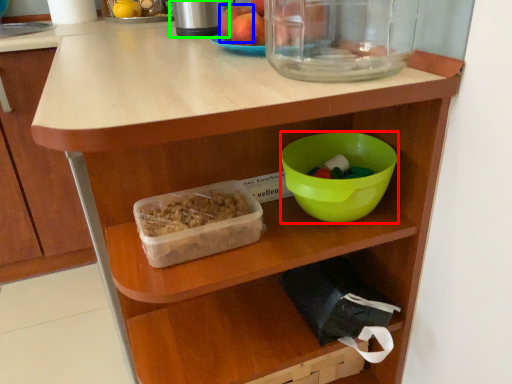
Question: Which object is the farthest from bowl (highlighted by a red box)? Choose among these: apple (highlighted by a blue box) or appliance (highlighted by a green box).

Choices:
 (A) apple
 (B) appliance

Answer: (B)